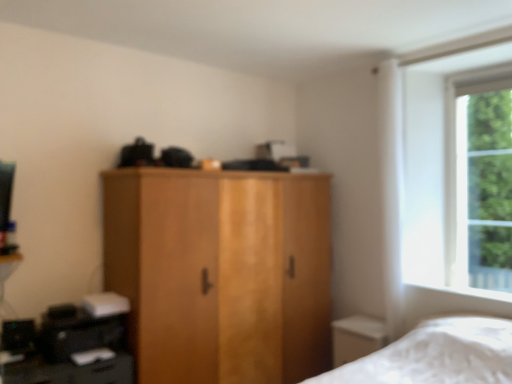
Question: Is wooden wardrobe at center positioned in front of black plastic printer at lower left?

Choices:
 (A) no
 (B) yes

Answer: (A)

Question: From the image's perspective, is wooden wardrobe at center located above black plastic printer at lower left?

Choices:
 (A) yes
 (B) no

Answer: (A)

Question: Is wooden wardrobe at center far from black plastic printer at lower left?

Choices:
 (A) no
 (B) yes

Answer: (A)

Question: Does wooden wardrobe at center have a lesser height compared to black plastic printer at lower left?

Choices:
 (A) no
 (B) yes

Answer: (A)

Question: Considering the relative positions of wooden wardrobe at center and black plastic printer at lower left in the image provided, is wooden wardrobe at center to the right of black plastic printer at lower left from the viewer's perspective?

Choices:
 (A) yes
 (B) no

Answer: (A)

Question: From a real-world perspective, is wooden wardrobe at center positioned under black plastic printer at lower left based on gravity?

Choices:
 (A) yes
 (B) no

Answer: (B)

Question: Would you say green leafy tree at right is part of wooden wardrobe at center's contents?

Choices:
 (A) no
 (B) yes

Answer: (A)

Question: Could you tell me if wooden wardrobe at center is facing green leafy tree at right?

Choices:
 (A) yes
 (B) no

Answer: (B)

Question: Is wooden wardrobe at center positioned with its back to green leafy tree at right?

Choices:
 (A) no
 (B) yes

Answer: (A)

Question: Is wooden wardrobe at center to the left of green leafy tree at right from the viewer's perspective?

Choices:
 (A) yes
 (B) no

Answer: (A)

Question: From a real-world perspective, does wooden wardrobe at center stand above green leafy tree at right?

Choices:
 (A) no
 (B) yes

Answer: (A)

Question: Does wooden wardrobe at center have a smaller size compared to green leafy tree at right?

Choices:
 (A) no
 (B) yes

Answer: (A)

Question: Considering the relative sizes of black plastic printer at lower left and green leafy tree at right in the image provided, is black plastic printer at lower left wider than green leafy tree at right?

Choices:
 (A) no
 (B) yes

Answer: (B)